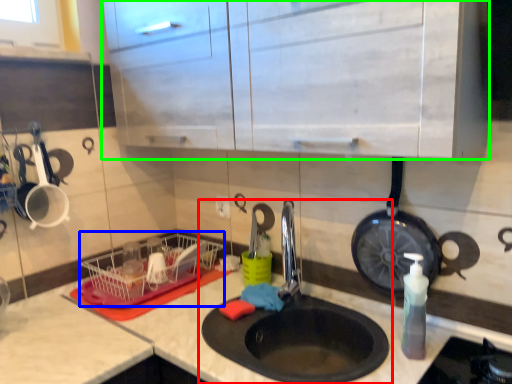
Question: Considering the real-world distances, which object is farthest from sink (highlighted by a red box)? basket (highlighted by a blue box) or cabinetry (highlighted by a green box)?

Choices:
 (A) basket
 (B) cabinetry

Answer: (B)